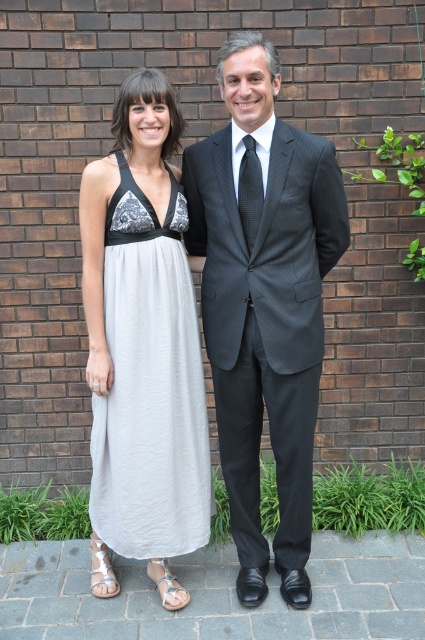
Question: Which point is closer to the camera?

Choices:
 (A) (224, 52)
 (B) (116, 248)

Answer: (A)

Question: Considering the relative positions of dark gray suit at center and light gray cotton dress at center in the image provided, where is dark gray suit at center located with respect to light gray cotton dress at center?

Choices:
 (A) below
 (B) above

Answer: (B)

Question: Among these objects, which one is nearest to the camera?

Choices:
 (A) dark gray suit at center
 (B) light gray cotton dress at center

Answer: (A)

Question: Can you confirm if dark gray suit at center is positioned to the right of light gray cotton dress at center?

Choices:
 (A) no
 (B) yes

Answer: (B)

Question: Can you confirm if dark gray suit at center is positioned below light gray cotton dress at center?

Choices:
 (A) yes
 (B) no

Answer: (B)

Question: Which point appears farthest from the camera in this image?

Choices:
 (A) (195, 374)
 (B) (311, 166)

Answer: (A)